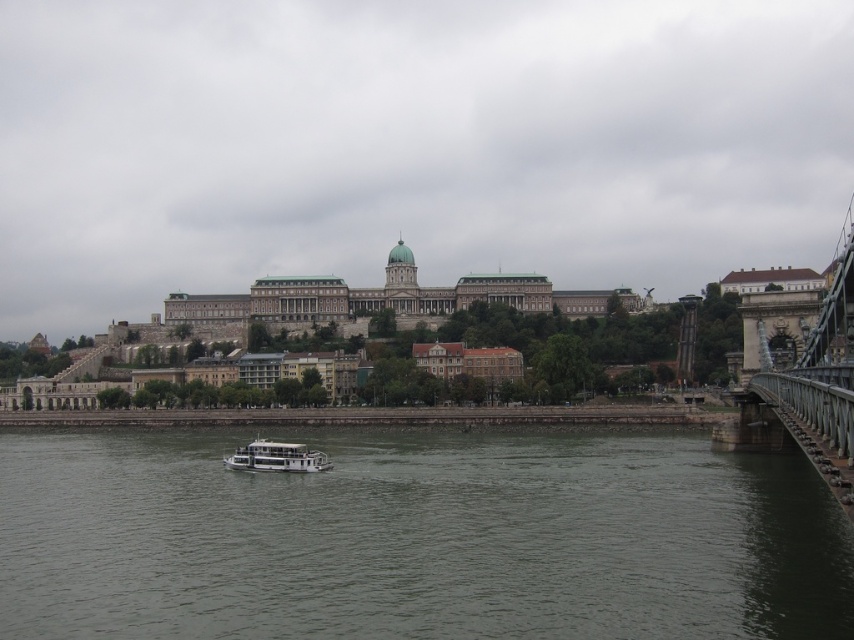
Question: Which object is the farthest from the metallic chain-link bridge at right?

Choices:
 (A) gray water at center
 (B) white matte boat at center

Answer: (B)

Question: Among these points, which one is nearest to the camera?

Choices:
 (A) (823, 308)
 (B) (237, 449)
 (C) (658, 580)

Answer: (C)

Question: Does metallic chain-link bridge at right appear on the left side of white matte boat at center?

Choices:
 (A) no
 (B) yes

Answer: (A)

Question: Is gray water at center positioned in front of metallic chain-link bridge at right?

Choices:
 (A) yes
 (B) no

Answer: (B)

Question: Among these points, which one is nearest to the camera?

Choices:
 (A) (151, 528)
 (B) (822, 339)

Answer: (B)

Question: Is gray water at center bigger than white matte boat at center?

Choices:
 (A) no
 (B) yes

Answer: (B)